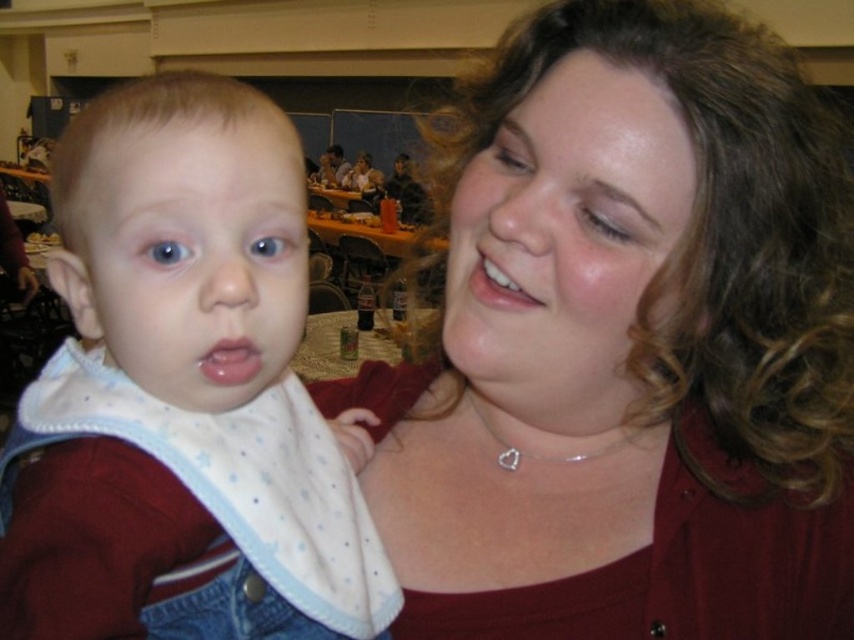
Question: Is matte red shirt at center positioned at the back of white dotted bib at left?

Choices:
 (A) yes
 (B) no

Answer: (A)

Question: Among these points, which one is farthest from the camera?

Choices:
 (A) (272, 355)
 (B) (540, 211)

Answer: (A)

Question: Which point is closer to the camera?

Choices:
 (A) 442,467
 (B) 123,317

Answer: (B)

Question: Which point appears closest to the camera in this image?

Choices:
 (A) pos(841,577)
 (B) pos(295,253)

Answer: (B)

Question: Does matte red shirt at center appear under white dotted bib at left?

Choices:
 (A) no
 (B) yes

Answer: (A)

Question: Is matte red shirt at center to the left of white dotted bib at left from the viewer's perspective?

Choices:
 (A) yes
 (B) no

Answer: (B)